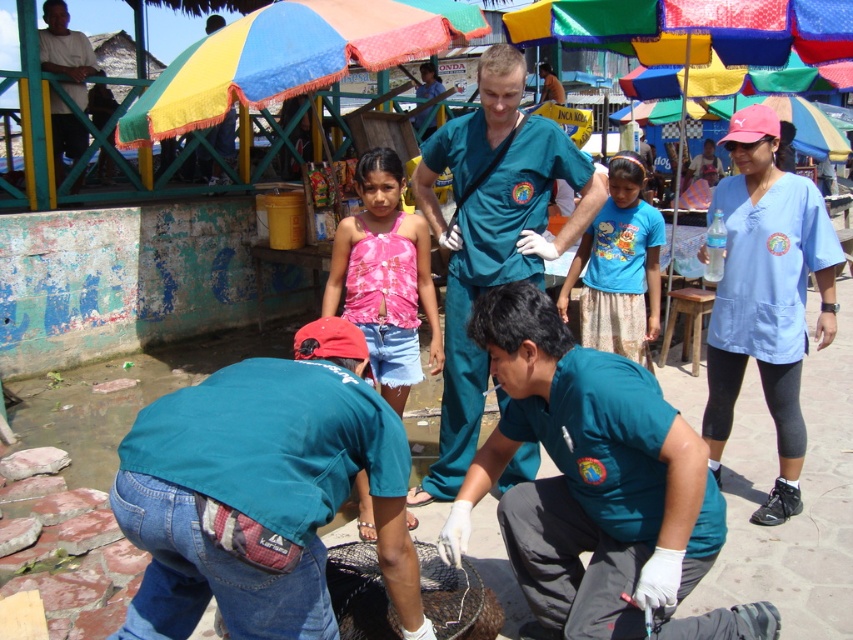
Does point (351, 310) lie in front of point (45, 17)?

Yes, it is in front of point (45, 17).

Locate an element on the screen. The image size is (853, 640). pink fabric top at center is located at coordinates (386, 276).

Who is more forward, [527,564] or [646,252]?

Point [527,564] is more forward.

Does teal uniform at center appear under blue cotton shirt at center?

Yes.

Is point (682, 452) closer to camera compared to point (647, 243)?

Yes.

Locate an element on the screen. The width and height of the screenshot is (853, 640). teal uniform at center is located at coordinates (595, 486).

The height and width of the screenshot is (640, 853). What do you see at coordinates (289, 58) in the screenshot? I see `multicolored fabric umbrella at upper center` at bounding box center [289, 58].

I want to click on multicolored fabric umbrella at upper center, so click(x=289, y=58).

The width and height of the screenshot is (853, 640). Identify the location of multicolored fabric umbrella at upper center. (x=289, y=58).